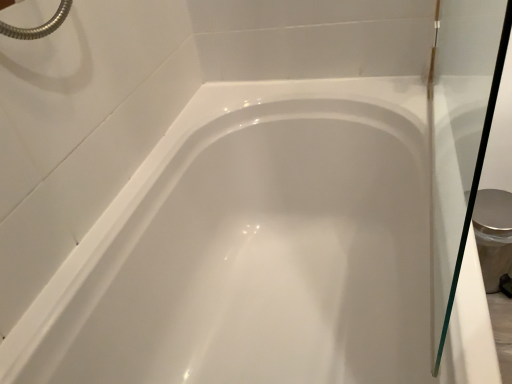
What do you see at coordinates (493, 234) in the screenshot?
I see `silver metallic toilet bowl at right` at bounding box center [493, 234].

What are the coordinates of `silver metallic toilet bowl at right` in the screenshot? It's located at (493, 234).

The image size is (512, 384). In order to click on silver metallic toilet bowl at right in this screenshot , I will do `click(493, 234)`.